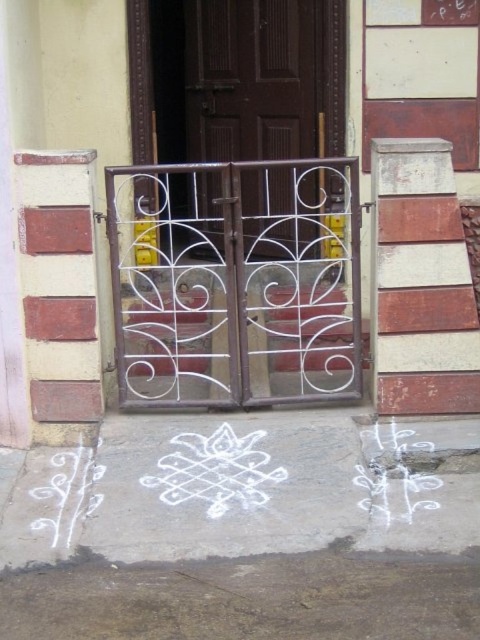
In the scene shown: You are a visitor approaching the entrance gates. You see the brown matte door at center and the white chalk writing at lower center. Which object is positioned higher relative to the other?

The brown matte door at center is above the white chalk writing at lower center, so it is positioned higher.

You are standing in front of the entrance gates and want to walk towards the brown matte door at center. Will you step over the white chalk writing at lower center before reaching the door?

The brown matte door at center is further to the viewer than the white chalk writing at lower center, so you will step over the white chalk writing at lower center before reaching the door.

You are a visitor approaching the entrance gates. You see a white chalk drawing at center and a white chalk writing at lower center on the ground. Which one is closer to the entrance gates?

The white chalk writing at lower center is closer to the entrance gates because it is located at the lower center, which is nearer to the gates compared to the white chalk drawing at center.